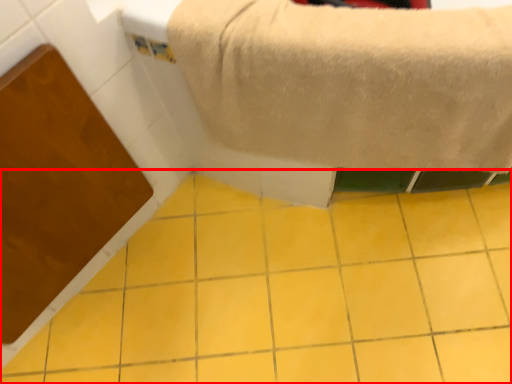
Question: Observing the image, what is the correct spatial positioning of ceramic tile (annotated by the red box) in reference to towel?

Choices:
 (A) left
 (B) right

Answer: (A)